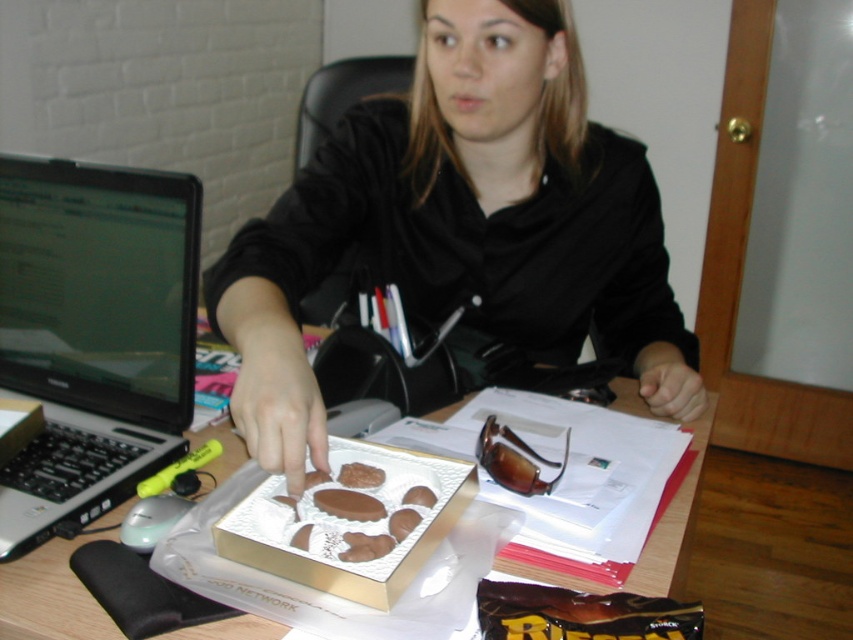
Who is taller, chocolate matte at center or chocolate-coated cookie at center?

With more height is chocolate matte at center.

Does point (351, 518) lie in front of point (369, 468)?

That is True.

Between point (372, 508) and point (373, 467), which one is positioned behind?

Positioned behind is point (373, 467).

I want to click on chocolate matte at center, so click(x=347, y=504).

Which is in front, point (350, 474) or point (424, 500)?

Positioned in front is point (424, 500).

Does chocolate-coated cookie at center appear on the right side of chocolate matte cookie at center?

Incorrect, chocolate-coated cookie at center is not on the right side of chocolate matte cookie at center.

Is point (358, 465) closer to viewer compared to point (426, 500)?

That is False.

Where is `chocolate-coated cookie at center`? chocolate-coated cookie at center is located at coordinates (360, 476).

Between gold foil box at center and chocolate matte cookie at center, which one is positioned lower?

gold foil box at center is lower down.

Is gold foil box at center thinner than chocolate matte cookie at center?

No.

Between point (372, 586) and point (422, 497), which one is positioned behind?

Positioned behind is point (422, 497).

The image size is (853, 640). In order to click on gold foil box at center in this screenshot , I will do `click(347, 524)`.